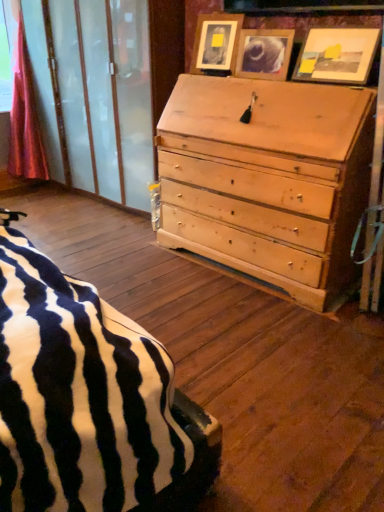
Question: Is point (23, 118) positioned closer to the camera than point (228, 14)?

Choices:
 (A) farther
 (B) closer

Answer: (A)

Question: From the image's perspective, relative to wooden picture frame at upper center, the third picture frame when ordered from right to left, is pink satin curtain at left above or below?

Choices:
 (A) above
 (B) below

Answer: (A)

Question: Based on their relative distances, which object is farther from the matte wooden picture frame at upper center, the second picture frame from the left?

Choices:
 (A) matte wooden picture frame at upper right, which ranks as the 3th picture frame in left-to-right order
 (B) pink satin curtain at left
 (C) wooden picture frame at upper center, the third picture frame when ordered from right to left

Answer: (B)

Question: Which object is the farthest from the matte wooden picture frame at upper right, acting as the 1th picture frame starting from the right?

Choices:
 (A) wooden picture frame at upper center, placed as the first picture frame when sorted from left to right
 (B) matte wooden picture frame at upper center, the second picture frame from the left
 (C) pink satin curtain at left

Answer: (C)